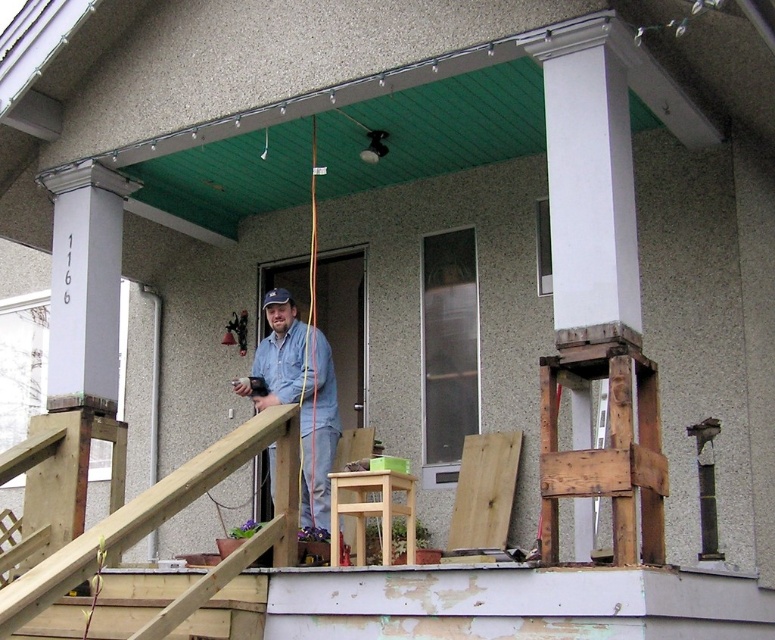
Question: Which of the following is the closest to the observer?

Choices:
 (A) (329, 540)
 (B) (291, 388)

Answer: (A)

Question: Is blue denim shirt at center in front of light brown wood chair at center?

Choices:
 (A) yes
 (B) no

Answer: (A)

Question: Can you confirm if blue denim shirt at center is smaller than light brown wood chair at center?

Choices:
 (A) yes
 (B) no

Answer: (B)

Question: Which point is closer to the camera taking this photo?

Choices:
 (A) (491, 522)
 (B) (360, 554)
 (C) (324, 524)

Answer: (B)

Question: Among these points, which one is farthest from the camera?

Choices:
 (A) (500, 474)
 (B) (388, 525)
 (C) (284, 372)

Answer: (C)

Question: Can you confirm if blue denim shirt at center is bigger than light brown wood chair at center?

Choices:
 (A) yes
 (B) no

Answer: (A)